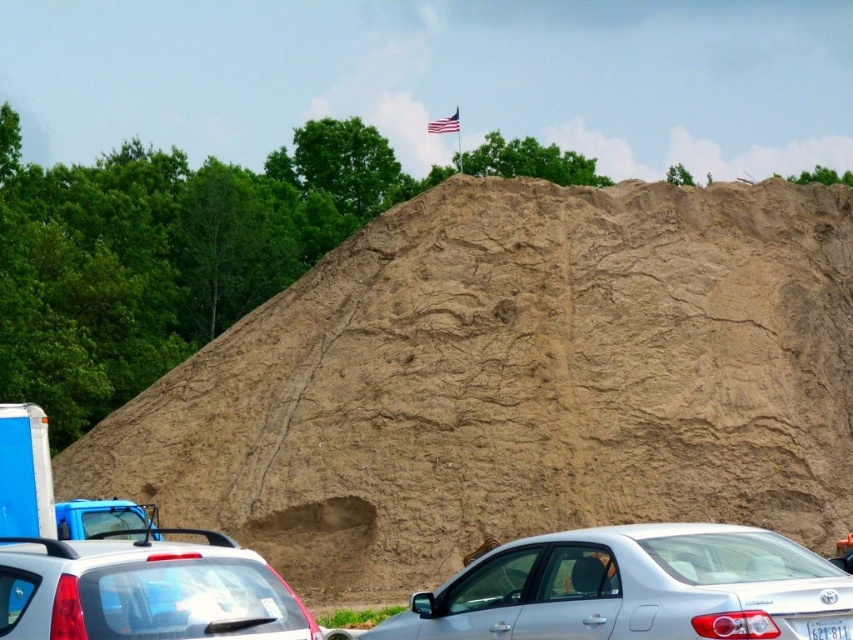
Question: Which object appears closest to the camera in this image?

Choices:
 (A) american flag at upper center
 (B) brown rough dirt at center
 (C) white matte hatchback at lower left
 (D) white plastic license plate at lower right

Answer: (C)

Question: Which point is closer to the camera?

Choices:
 (A) click(454, 129)
 (B) click(680, 307)
 (C) click(500, 593)
 (D) click(834, 637)

Answer: (D)

Question: Can you confirm if brown rough dirt at center is bigger than satin silver sedan at center?

Choices:
 (A) no
 (B) yes

Answer: (B)

Question: Does brown rough dirt at center appear over satin silver sedan at center?

Choices:
 (A) yes
 (B) no

Answer: (A)

Question: Based on their relative distances, which object is nearer to the brown rough dirt at center?

Choices:
 (A) satin silver sedan at center
 (B) white matte hatchback at lower left
 (C) american flag at upper center
 (D) white plastic license plate at lower right

Answer: (A)

Question: From the image, what is the correct spatial relationship of satin silver sedan at center in relation to white matte hatchback at lower left?

Choices:
 (A) right
 (B) left

Answer: (A)